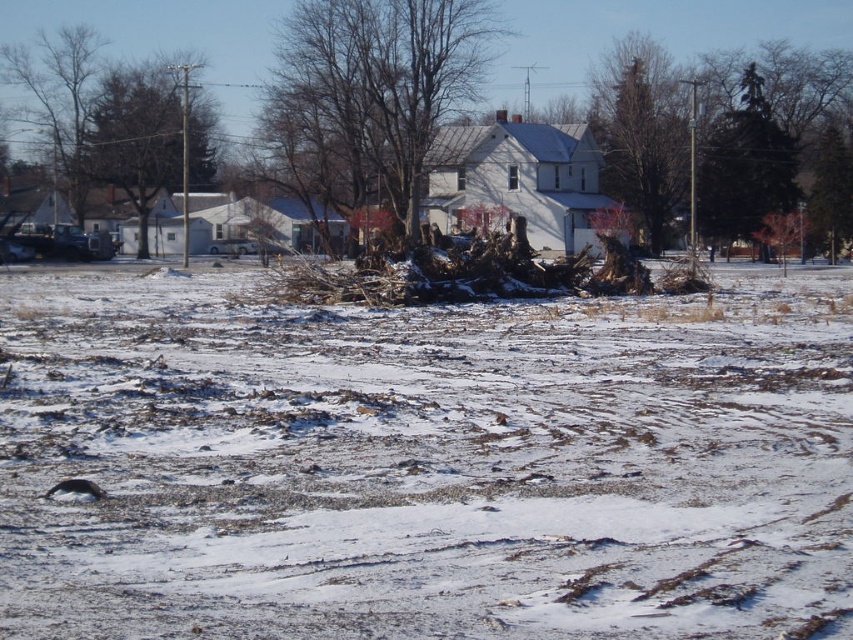
You are planning to hang a bird feeder between the green textured tree at upper right and the green evergreen tree at upper right. Given that the feeder requires 8 feet of space between the trees to be installed safely, will there be enough space?

The distance between the green textured tree at upper right and the green evergreen tree at upper right is 7.58 feet, which is less than the required 8 feet. Therefore, there is not enough space to install the bird feeder safely between them.

You are standing in the winter scene and notice two trees in the midground. One is a green leafy tree at upper left and the other is bare branches at left. Which tree is positioned to the right of the other?

The green leafy tree at upper left is positioned to the right of the bare branches at left.